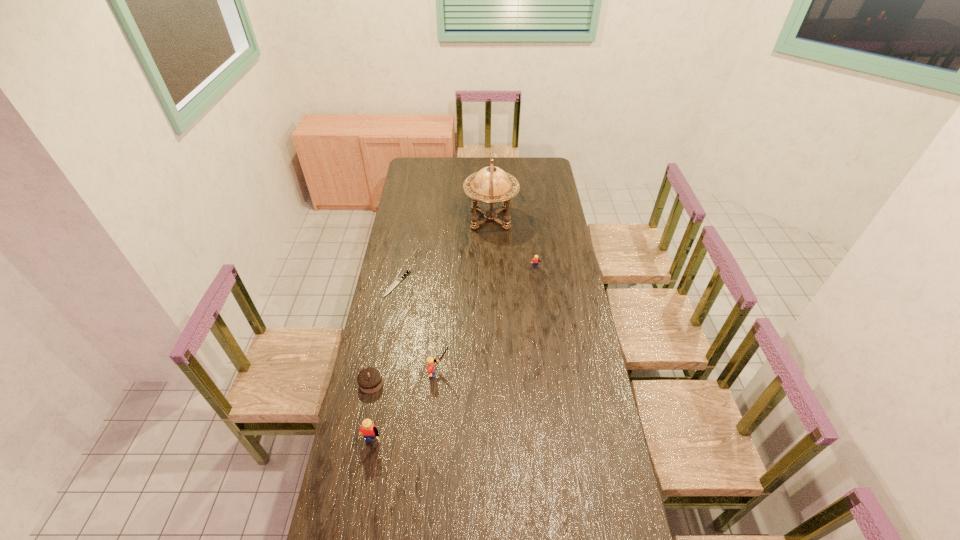
Find the location of a particular element. free space that is in between the tallest object and the nearest object is located at coordinates (431, 334).

Image resolution: width=960 pixels, height=540 pixels. In order to click on free area in between the third shortest object and the chocolate cake in this screenshot , I will do `click(453, 326)`.

The image size is (960, 540). In order to click on vacant space that's between the rightmost Lego and the nearest object in this screenshot , I will do `click(453, 359)`.

You are a GUI agent. You are given a task and a screenshot of the screen. Output one action in this format:
    pyautogui.click(x=<x>, y=<y>)
    Task: Click on the vacant space that's between the fifth tallest object and the rightmost Lego
    
    Given the screenshot: What is the action you would take?
    pyautogui.click(x=453, y=326)

This screenshot has width=960, height=540. What are the coordinates of `free spot between the rightmost Lego and the steak knife` in the screenshot? It's located at (467, 276).

Locate an element on the screen. vacant region between the farthest Lego and the third tallest object is located at coordinates (488, 321).

Where is `object that stands as the second closest to the steak knife`? The width and height of the screenshot is (960, 540). object that stands as the second closest to the steak knife is located at coordinates (430, 361).

Image resolution: width=960 pixels, height=540 pixels. I want to click on object that is the fifth nearest to the second shortest object, so click(491, 185).

Locate which Lego is the second closest to the chocolate cake. Please provide its 2D coordinates. Your answer should be formatted as a tuple, i.e. [(x, y)], where the tuple contains the x and y coordinates of a point satisfying the conditions above.

[(430, 361)]

Locate which Lego ranks third in proximity to the shortest object. Please provide its 2D coordinates. Your answer should be formatted as a tuple, i.e. [(x, y)], where the tuple contains the x and y coordinates of a point satisfying the conditions above.

[(368, 429)]